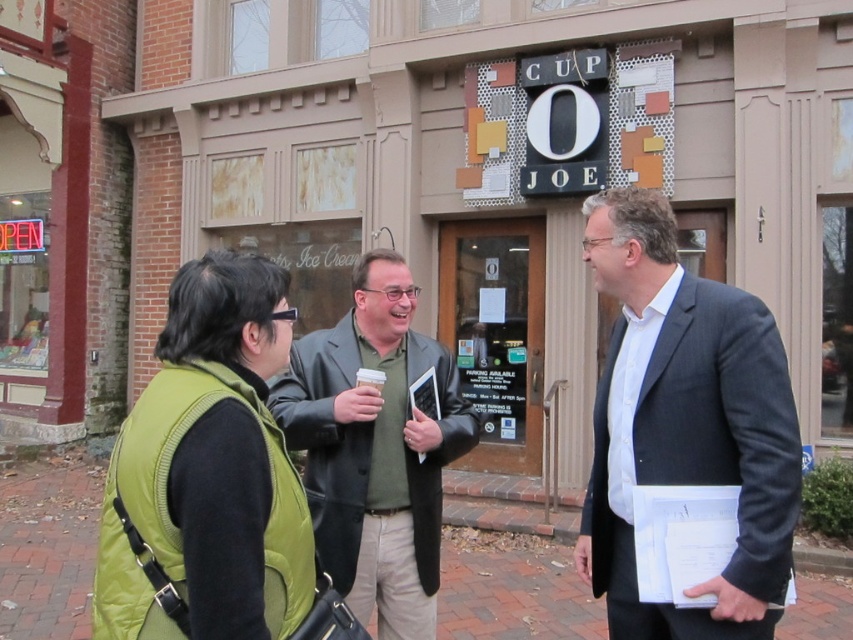
You are standing at the entrance of Cup O Joe and notice two items in your view. Which one is closer to you between the green quilted vest at lower left and the brick pavement at lower center?

The green quilted vest at lower left is closer to you since it is in front of the brick pavement at lower center.

You are standing in front of the Cup O Joe storefront and notice two items in the scene. One is the green fabric jacket at center and the other is the brick pavement at lower center. Which of these two items appears narrower from your perspective?

The green fabric jacket at center appears narrower than the brick pavement at lower center because it has a lesser width compared to the brick pavement at lower center.

You are standing at the entrance of Cup O Joe and see two points marked in the scene. The first point is at coordinate point (231, 433) and the second point is at coordinate point (430, 522). Which of these two points is closer to you?

Point (231, 433) is closer to you because it is in front of point (430, 522).